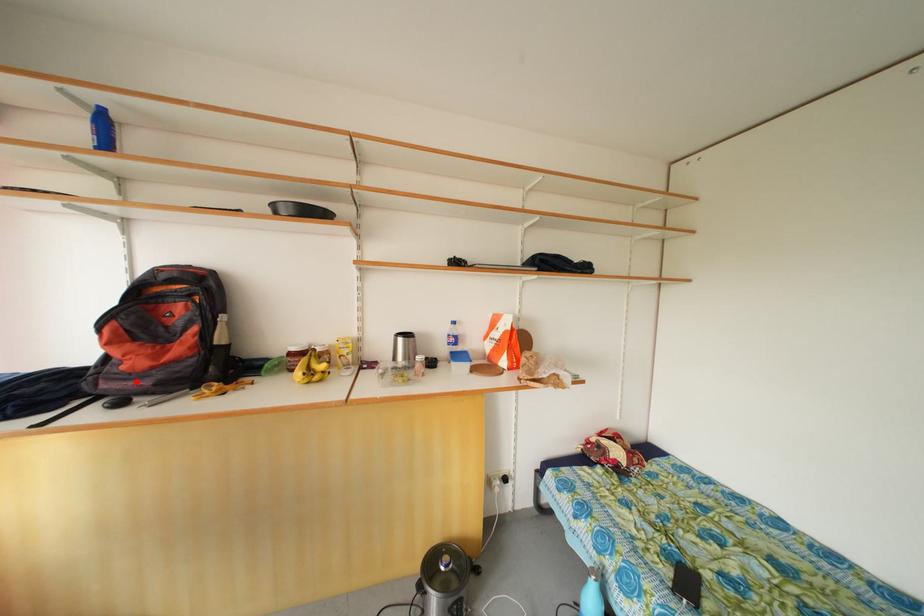
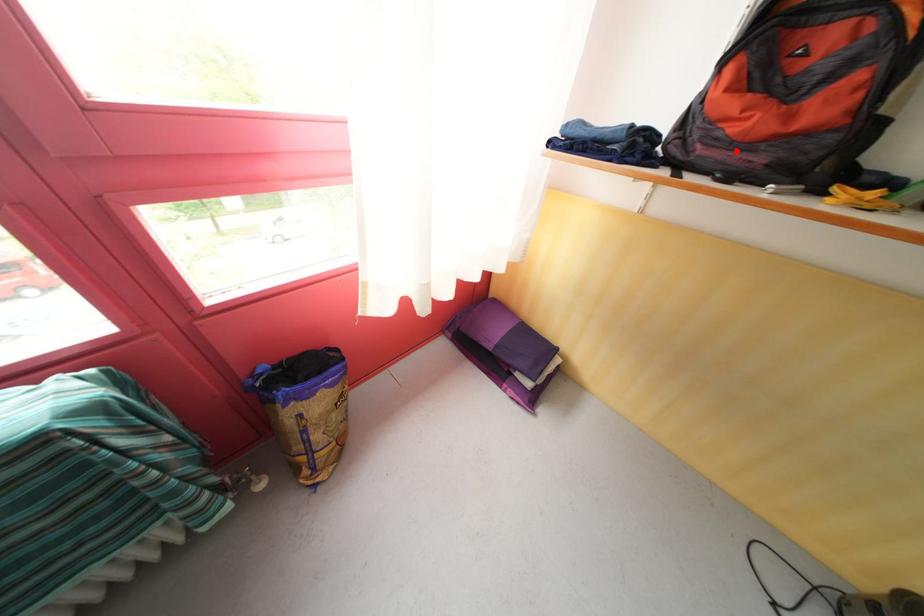
I am providing you with two images of the same scene from different viewpoints. A red point is marked on the first image and another point is marked on the second image. Are the points marked in image1 and image2 representing the same 3D position?

Yes